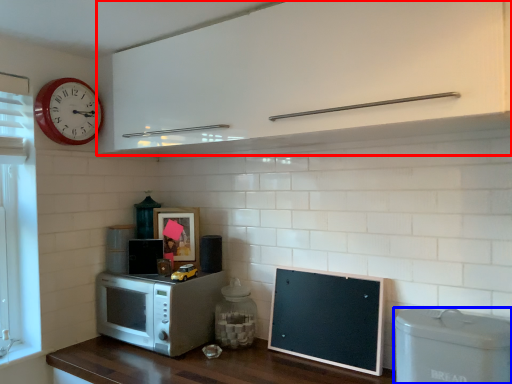
Question: Among these objects, which one is farthest to the camera, cabinetry (highlighted by a red box) or appliance (highlighted by a blue box)?

Choices:
 (A) cabinetry
 (B) appliance

Answer: (B)